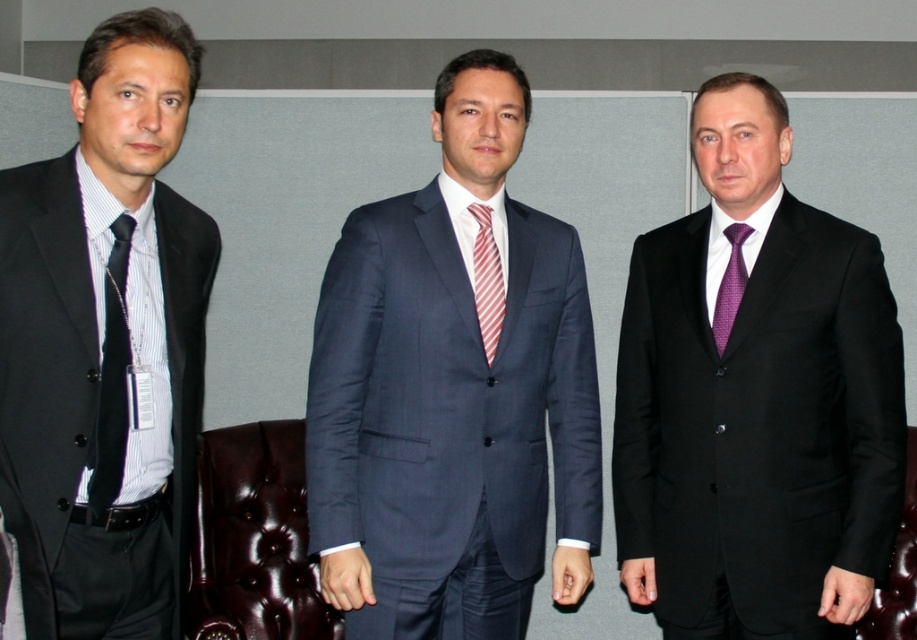
Does black silk tie at left appear over purple textured tie at center?

Incorrect, black silk tie at left is not positioned above purple textured tie at center.

Who is shorter, black silk tie at left or purple textured tie at center?

Standing shorter between the two is purple textured tie at center.

What do you see at coordinates (112, 380) in the screenshot? I see `black silk tie at left` at bounding box center [112, 380].

The image size is (917, 640). What are the coordinates of `black silk tie at left` in the screenshot? It's located at (112, 380).

Can you confirm if matte black suit at left is thinner than leather at center?

Incorrect, matte black suit at left's width is not less than leather at center's.

Can you confirm if matte black suit at left is positioned to the left of leather at center?

Yes, matte black suit at left is to the left of leather at center.

Which is behind, point (8, 304) or point (914, 598)?

Positioned behind is point (914, 598).

Locate an element on the screen. The height and width of the screenshot is (640, 917). matte black suit at left is located at coordinates (105, 340).

Can you confirm if leather at center is wider than red striped tie at center?

Yes, leather at center is wider than red striped tie at center.

Does point (908, 444) lie in front of point (498, 256)?

That is False.

Describe the element at coordinates (897, 570) in the screenshot. I see `leather at center` at that location.

This screenshot has height=640, width=917. What are the coordinates of `leather at center` in the screenshot? It's located at (897, 570).